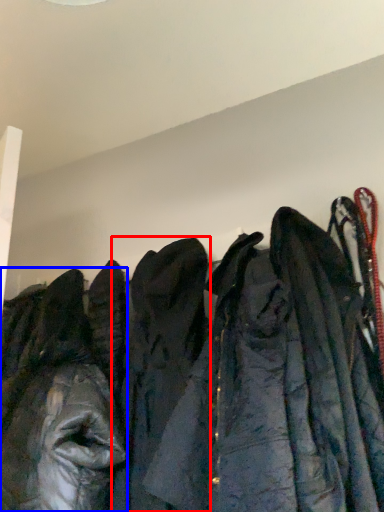
Question: Which of the following is the closest to the observer, cloak (highlighted by a red box) or jacket (highlighted by a blue box)?

Choices:
 (A) cloak
 (B) jacket

Answer: (A)